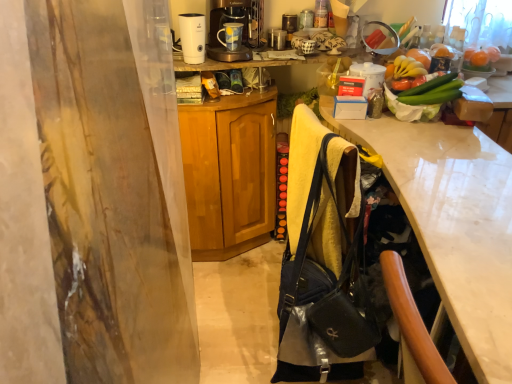
Question: Is orange matte fruit at upper right thinner than wooden cabinet at center?

Choices:
 (A) no
 (B) yes

Answer: (B)

Question: Is orange matte fruit at upper right facing away from wooden cabinet at center?

Choices:
 (A) no
 (B) yes

Answer: (A)

Question: From a real-world perspective, is orange matte fruit at upper right beneath wooden cabinet at center?

Choices:
 (A) yes
 (B) no

Answer: (B)

Question: Considering the relative positions of orange matte fruit at upper right and wooden cabinet at center in the image provided, is orange matte fruit at upper right to the left of wooden cabinet at center from the viewer's perspective?

Choices:
 (A) yes
 (B) no

Answer: (B)

Question: Is orange matte fruit at upper right not within wooden cabinet at center?

Choices:
 (A) no
 (B) yes

Answer: (B)

Question: In terms of width, does white plastic humidifier at upper center look wider or thinner when compared to metallic silver coffee maker at upper center, arranged as the second appliance when ordered from the bottom?

Choices:
 (A) thin
 (B) wide

Answer: (B)

Question: Considering the positions of white plastic humidifier at upper center and metallic silver coffee maker at upper center, placed as the first appliance when sorted from left to right, in the image, is white plastic humidifier at upper center bigger or smaller than metallic silver coffee maker at upper center, placed as the first appliance when sorted from left to right,?

Choices:
 (A) small
 (B) big

Answer: (B)

Question: Based on their positions, is white plastic humidifier at upper center located to the left or right of metallic silver coffee maker at upper center, the second appliance viewed from the front?

Choices:
 (A) left
 (B) right

Answer: (A)

Question: Considering the positions of point (188, 61) and point (272, 46), is point (188, 61) closer or farther from the camera than point (272, 46)?

Choices:
 (A) farther
 (B) closer

Answer: (B)

Question: Is metallic silver coffee maker at upper center, which is counted as the first appliance, starting from the top, to the left or to the right of white glossy desk at right in the image?

Choices:
 (A) right
 (B) left

Answer: (B)

Question: From a real-world perspective, is metallic silver coffee maker at upper center, the second appliance viewed from the front, above or below white glossy desk at right?

Choices:
 (A) above
 (B) below

Answer: (A)

Question: Is metallic silver coffee maker at upper center, which ranks as the 1th appliance in back-to-front order, bigger or smaller than white glossy desk at right?

Choices:
 (A) small
 (B) big

Answer: (A)

Question: Is point (278, 46) closer or farther from the camera than point (419, 196)?

Choices:
 (A) farther
 (B) closer

Answer: (A)

Question: From a real-world perspective, is wooden cabinet at center positioned above or below metallic silver coffee maker at upper center?

Choices:
 (A) below
 (B) above

Answer: (A)

Question: Considering the positions of wooden cabinet at center and metallic silver coffee maker at upper center in the image, is wooden cabinet at center taller or shorter than metallic silver coffee maker at upper center?

Choices:
 (A) short
 (B) tall

Answer: (B)